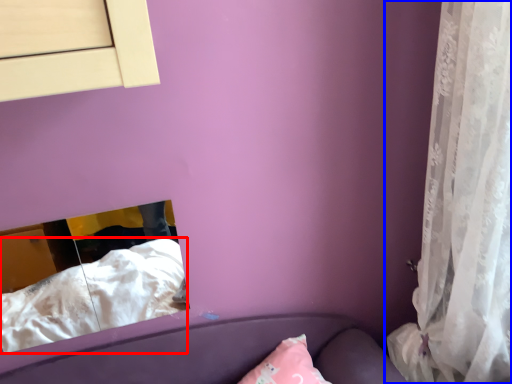
Question: Which of the following is the farthest to the observer, sheet (highlighted by a red box) or curtain (highlighted by a blue box)?

Choices:
 (A) sheet
 (B) curtain

Answer: (A)